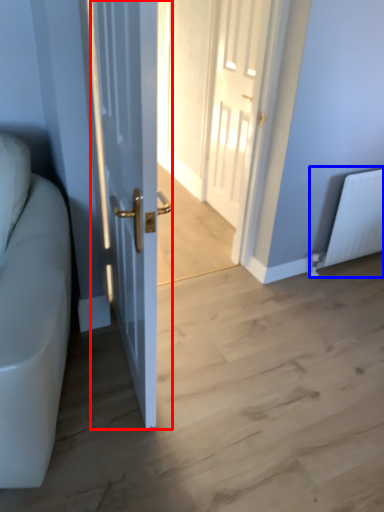
Question: Which object appears closest to the camera in this image, door (highlighted by a red box) or radiator (highlighted by a blue box)?

Choices:
 (A) door
 (B) radiator

Answer: (A)